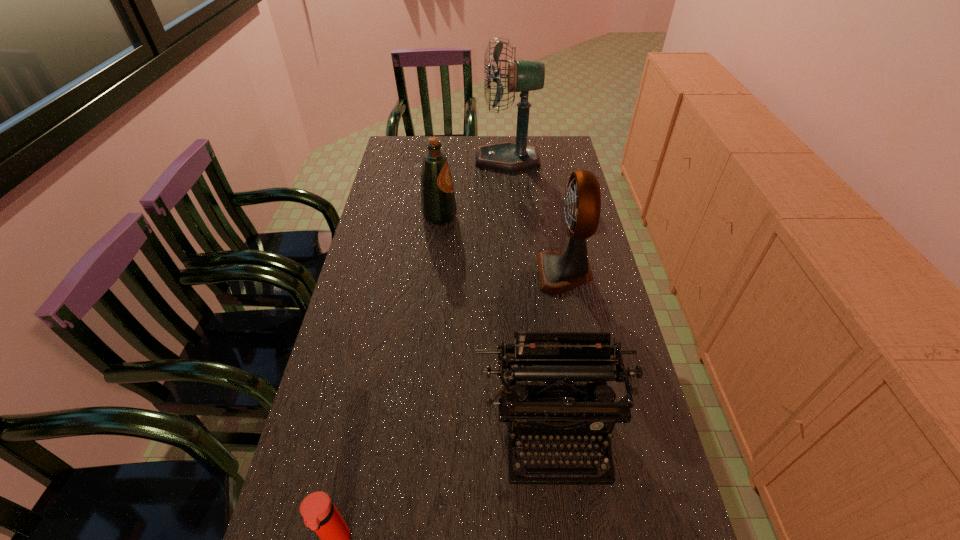
Find the location of a particular element. The width and height of the screenshot is (960, 540). free space located on the front-facing side of the shorter fan is located at coordinates (413, 272).

Where is `vacant space situated on the front-facing side of the shorter fan`? The width and height of the screenshot is (960, 540). vacant space situated on the front-facing side of the shorter fan is located at coordinates (423, 272).

The height and width of the screenshot is (540, 960). What are the coordinates of `vacant point located on the front-facing side of the shorter fan` in the screenshot? It's located at (413, 272).

Find the location of a particular element. free space located 0.280m on the front-facing side of the fourth object from right to left is located at coordinates (540, 217).

Identify the location of object present at the far edge. This screenshot has width=960, height=540. (523, 76).

You are a GUI agent. You are given a task and a screenshot of the screen. Output one action in this format:
    pyautogui.click(x=<x>, y=<y>)
    Task: Click on the typewriter that is positioned at the right edge
    
    Given the screenshot: What is the action you would take?
    pyautogui.click(x=551, y=357)

The height and width of the screenshot is (540, 960). In order to click on object located in the far right corner section of the desktop in this screenshot , I will do `click(523, 76)`.

Image resolution: width=960 pixels, height=540 pixels. Find the location of `vacant region at the far edge`. vacant region at the far edge is located at coordinates (468, 136).

You are a GUI agent. You are given a task and a screenshot of the screen. Output one action in this format:
    pyautogui.click(x=<x>, y=<y>)
    Task: Click on the vacant region at the left edge of the desktop
    This screenshot has height=540, width=960.
    Given the screenshot: What is the action you would take?
    pyautogui.click(x=381, y=221)

Locate an element on the screen. The width and height of the screenshot is (960, 540). vacant space at the right edge of the desktop is located at coordinates (636, 523).